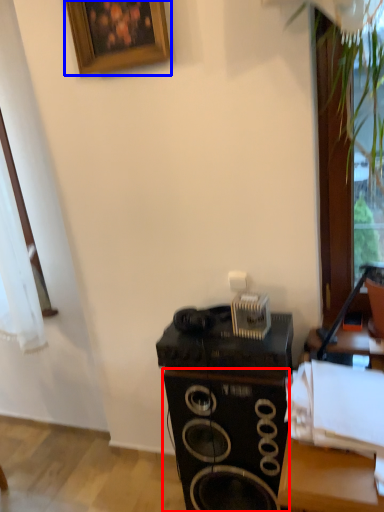
Question: Which object is closer to the camera taking this photo, speaker (highlighted by a red box) or picture frame (highlighted by a blue box)?

Choices:
 (A) speaker
 (B) picture frame

Answer: (A)